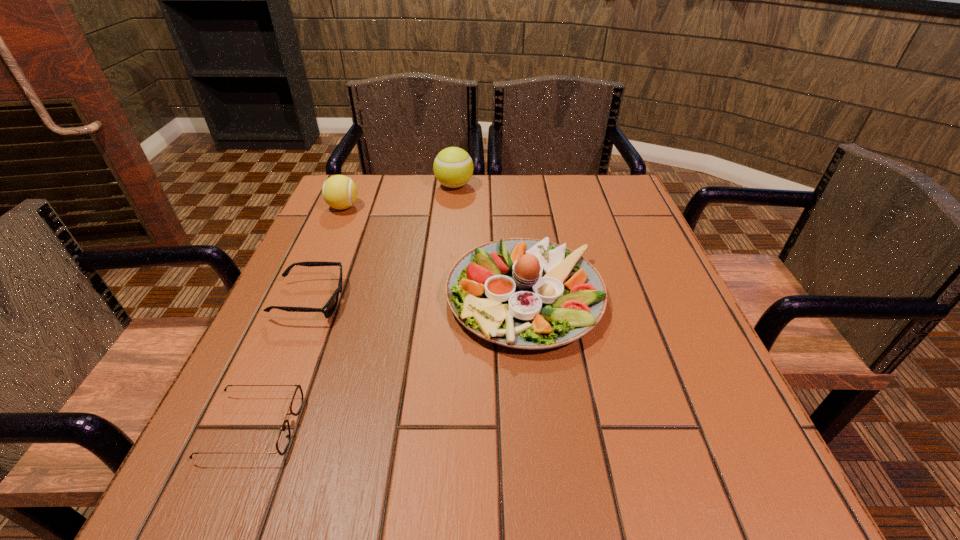
In the image, there is a desktop. Where is `vacant space at the left edge`? This screenshot has height=540, width=960. vacant space at the left edge is located at coordinates (353, 239).

I want to click on vacant space at the right edge of the desktop, so click(x=637, y=262).

Identify the location of vacant point at the far left corner. The height and width of the screenshot is (540, 960). (324, 219).

The width and height of the screenshot is (960, 540). Find the location of `vacant space at the far right corner`. vacant space at the far right corner is located at coordinates (614, 186).

Where is `free space between the shortest object and the salad plate`? free space between the shortest object and the salad plate is located at coordinates (389, 362).

This screenshot has width=960, height=540. I want to click on blank region between the nearer tennis ball and the nearer sunglasses, so click(x=299, y=317).

Identify the location of free space between the nearer sunglasses and the farthest object. (353, 306).

The height and width of the screenshot is (540, 960). I want to click on free space between the salad plate and the farther sunglasses, so click(418, 298).

At what (x,y) coordinates should I click in order to perform the action: click on vacant region between the nearest object and the right tennis ball. Please return your answer as a coordinate pair (x, y). The image size is (960, 540). Looking at the image, I should click on (353, 306).

Identify the location of free spot between the salad plate and the second farthest object. (434, 252).